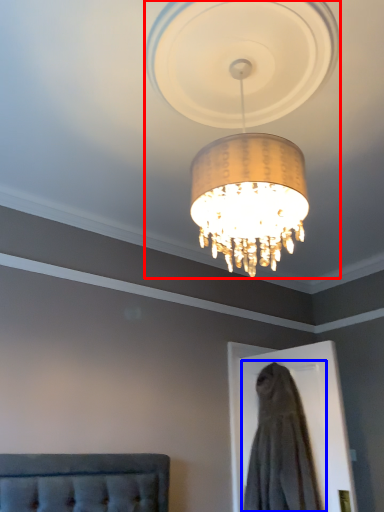
Question: Which point is further to the camera, lamp (highlighted by a red box) or dress (highlighted by a blue box)?

Choices:
 (A) lamp
 (B) dress

Answer: (B)